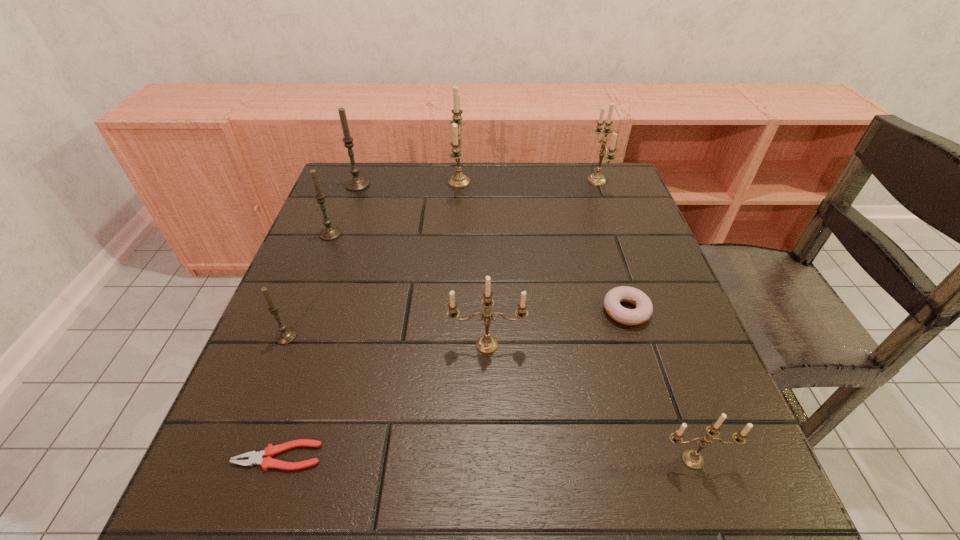
Identify the location of vacant area that lies between the second biggest gray candle and the nearest candle. (512, 347).

The width and height of the screenshot is (960, 540). In order to click on vacant area that lies between the smallest metallic candle and the shortest object in this screenshot , I will do `click(485, 458)`.

At what (x,y) coordinates should I click in order to perform the action: click on free space between the fourth farthest object and the doughnut. Please return your answer as a coordinate pair (x, y). The height and width of the screenshot is (540, 960). Looking at the image, I should click on (478, 272).

Locate an element on the screen. The width and height of the screenshot is (960, 540). free spot between the doughnut and the pliers is located at coordinates (452, 383).

Locate an element on the screen. vacant point located between the third smallest metallic candle and the second smallest metallic candle is located at coordinates (x=541, y=262).

Where is `unoccupied area between the second shortest object and the farthest gray candle`? This screenshot has height=540, width=960. unoccupied area between the second shortest object and the farthest gray candle is located at coordinates (492, 248).

This screenshot has width=960, height=540. I want to click on object that is the eighth closest to the tallest candle, so click(691, 458).

Locate which object ranks in proximity to the fourth nearest candle. Please provide its 2D coordinates. Your answer should be formatted as a tuple, i.e. [(x, y)], where the tuple contains the x and y coordinates of a point satisfying the conditions above.

[(356, 183)]

Locate an element on the screen. This screenshot has height=540, width=960. candle that is the fourth closest one to the second nearest metallic candle is located at coordinates (458, 180).

Find the location of a particular element. The height and width of the screenshot is (540, 960). candle that can be found as the third closest to the smallest gray candle is located at coordinates (356, 183).